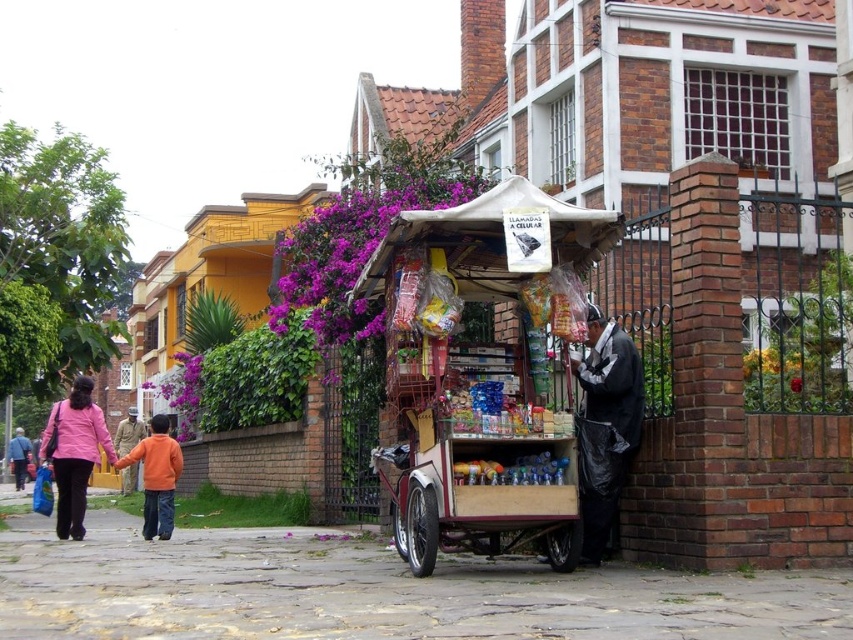
You are a customer looking to buy a jacket from the stall. You see the matte pink sweater at left and the orange cotton jacket at lower left. Which one is closer to the ground?

The orange cotton jacket at lower left is closer to the ground because it is positioned below the matte pink sweater at left.

You are a delivery person who needs to place a package in the area near the black metal gate. You have two options for storage spots next to the food stall. One is next to the black plastic bag at lower right and the other is next to the matte pink sweater at left. Which storage spot has more space available?

The storage spot next to the matte pink sweater at left has more space available because the black plastic bag at lower right occupies less space than the matte pink sweater at left.